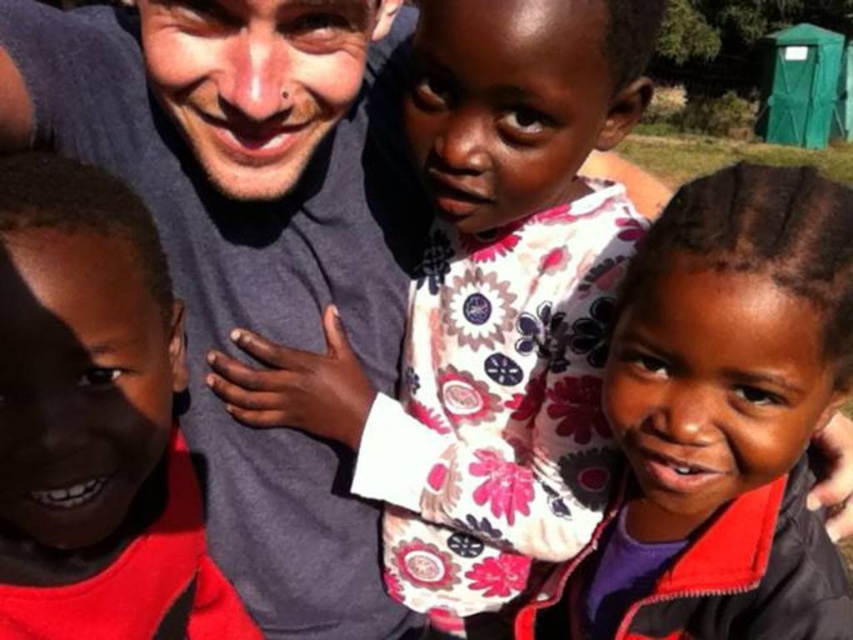
In the scene shown: Is matte floral dress at center positioned at the back of matte red shirt at left?

Yes, it is behind matte red shirt at left.

Does matte floral dress at center have a smaller size compared to matte red shirt at left?

No, matte floral dress at center is not smaller than matte red shirt at left.

Where is `matte floral dress at center`? This screenshot has width=853, height=640. matte floral dress at center is located at coordinates (718, 420).